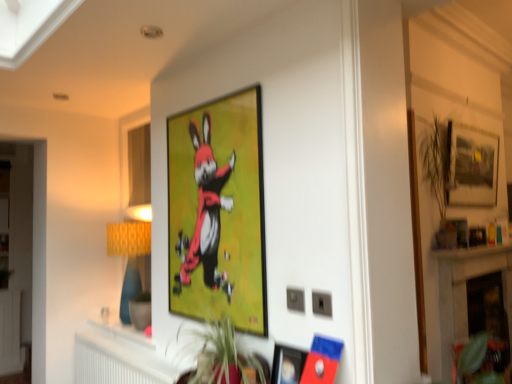
Locate an element on the screen. This screenshot has width=512, height=384. white plastic radiator at lower center is located at coordinates (117, 362).

Identify the location of matte plastic picture frame at lower center, the 1th picture frame when ordered from front to back. The image size is (512, 384). (287, 365).

The height and width of the screenshot is (384, 512). In order to click on green leafy plant at center, the second plant in the bottom-to-top sequence in this screenshot , I will do `click(223, 357)`.

At what (x,y) coordinates should I click in order to perform the action: click on matte black picture frame at upper center, which is the second picture frame from back to front. Please return your answer as a coordinate pair (x, y). Image resolution: width=512 pixels, height=384 pixels. Looking at the image, I should click on (218, 212).

Measure the distance between yellow fabric lampshade at left and camera.

They are 2.44 meters apart.

Where is `matte black picture frame at upper right, the first picture frame in the back-to-front sequence`? The height and width of the screenshot is (384, 512). matte black picture frame at upper right, the first picture frame in the back-to-front sequence is located at coordinates (472, 166).

Between yellow fabric lampshade at left and white marble fireplace at lower right, which one has more height?

white marble fireplace at lower right is taller.

Between yellow fabric lampshade at left and white marble fireplace at lower right, which one has larger size?

With larger size is white marble fireplace at lower right.

Which object is positioned more to the left, yellow fabric lampshade at left or white marble fireplace at lower right?

Positioned to the left is yellow fabric lampshade at left.

You are a GUI agent. You are given a task and a screenshot of the screen. Output one action in this format:
    pyautogui.click(x=<x>, y=<y>)
    Task: Click on the lamp in front of the white marble fireplace at lower right
    The image size is (512, 384).
    Given the screenshot: What is the action you would take?
    pyautogui.click(x=131, y=258)

Who is smaller, white plastic radiator at lower center or matte black picture frame at upper center, placed as the 2th picture frame when sorted from front to back?

Smaller between the two is matte black picture frame at upper center, placed as the 2th picture frame when sorted from front to back.

Considering the positions of objects white plastic radiator at lower center and matte black picture frame at upper center, which is the second picture frame from back to front, in the image provided, who is more to the left, white plastic radiator at lower center or matte black picture frame at upper center, which is the second picture frame from back to front,?

white plastic radiator at lower center.

Is white plastic radiator at lower center wider than matte black picture frame at upper center, placed as the 1th picture frame when sorted from left to right?

Yes.

Which is behind, point (479, 372) or point (120, 250)?

Point (120, 250)

Is green leafy plant at lower right, the 2th plant viewed from the top, located outside yellow fabric lampshade at left?

green leafy plant at lower right, the 2th plant viewed from the top, lies outside yellow fabric lampshade at left's area.

Can you tell me how much green leafy plant at lower right, the 2th plant viewed from the top, and yellow fabric lampshade at left differ in facing direction?

green leafy plant at lower right, the 2th plant viewed from the top, and yellow fabric lampshade at left are facing 90 degrees away from each other.

Is green leafy plant at lower right, arranged as the 1th plant when viewed from the right, facing away from yellow fabric lampshade at left?

That's not correct — green leafy plant at lower right, arranged as the 1th plant when viewed from the right, is not looking away from yellow fabric lampshade at left.

Based on the photo, between white marble fireplace at lower right and green leafy plant at center, the second plant in the bottom-to-top sequence, which one has smaller size?

green leafy plant at center, the second plant in the bottom-to-top sequence.

From a real-world perspective, which object rests below the other?

From a 3D spatial view, white marble fireplace at lower right is below.

From the image's perspective, which object appears higher, white marble fireplace at lower right or green leafy plant at center, placed as the first plant when sorted from left to right?

green leafy plant at center, placed as the first plant when sorted from left to right, is shown above in the image.

From the image's perspective, which one is positioned lower, matte plastic picture frame at lower center, the second picture frame from the right, or matte black picture frame at upper center, placed as the 1th picture frame when sorted from left to right?

matte plastic picture frame at lower center, the second picture frame from the right, is shown below in the image.

Is matte plastic picture frame at lower center, marked as the third picture frame in a back-to-front arrangement, not close to matte black picture frame at upper center, which is the second picture frame from back to front?

No.

Is matte plastic picture frame at lower center, which is counted as the second picture frame, starting from the left, positioned before matte black picture frame at upper center, placed as the 1th picture frame when sorted from left to right?

Yes, matte plastic picture frame at lower center, which is counted as the second picture frame, starting from the left, is closer to the camera.

Considering the relative sizes of white marble fireplace at lower right and yellow fabric lampshade at left in the image provided, is white marble fireplace at lower right bigger than yellow fabric lampshade at left?

Indeed, white marble fireplace at lower right has a larger size compared to yellow fabric lampshade at left.

In the scene shown: From a real-world perspective, relative to yellow fabric lampshade at left, is white marble fireplace at lower right vertically above or below?

white marble fireplace at lower right is situated lower than yellow fabric lampshade at left in the real world.

Is point (480, 270) less distant than point (110, 249)?

No, (480, 270) is behind (110, 249).

Which object is wider, white marble fireplace at lower right or yellow fabric lampshade at left?

yellow fabric lampshade at left.

Does green leafy plant at center, which is counted as the 1th plant, starting from the top, appear on the right side of matte black picture frame at upper right, acting as the third picture frame starting from the left?

No.

Considering the positions of point (232, 328) and point (486, 195), is point (232, 328) closer or farther from the camera than point (486, 195)?

Point (232, 328) appears to be closer to the viewer than point (486, 195).

Are green leafy plant at center, placed as the second plant when sorted from back to front, and matte black picture frame at upper right, the first picture frame in the back-to-front sequence, beside each other?

There is a gap between green leafy plant at center, placed as the second plant when sorted from back to front, and matte black picture frame at upper right, the first picture frame in the back-to-front sequence.

Does green leafy plant at center, which is counted as the 1th plant, starting from the top, have a lesser height compared to matte black picture frame at upper right, the first picture frame in the back-to-front sequence?

Yes, green leafy plant at center, which is counted as the 1th plant, starting from the top, is shorter than matte black picture frame at upper right, the first picture frame in the back-to-front sequence.

Image resolution: width=512 pixels, height=384 pixels. I want to click on fireplace lying on the right of yellow fabric lampshade at left, so click(x=466, y=291).

The height and width of the screenshot is (384, 512). What are the coordinates of `the 1st picture frame in front of the white plastic radiator at lower center, counting from the anchor's position` in the screenshot? It's located at 218,212.

Estimate the real-world distances between objects in this image. Which object is further from matte plastic picture frame at lower center, which is counted as the second picture frame, starting from the left, matte black picture frame at upper right, the 1th picture frame viewed from the right, or yellow fabric lampshade at left?

Based on the image, matte black picture frame at upper right, the 1th picture frame viewed from the right, appears to be further to matte plastic picture frame at lower center, which is counted as the second picture frame, starting from the left.

Looking at the image, which one is located further to white plastic radiator at lower center, matte plastic picture frame at lower center, marked as the third picture frame in a back-to-front arrangement, or yellow fabric lampshade at left?

matte plastic picture frame at lower center, marked as the third picture frame in a back-to-front arrangement.

Which object lies nearer to the anchor point white marble fireplace at lower right, green leafy plant at center, which is counted as the 1th plant, starting from the top, or matte black picture frame at upper right, the third picture frame viewed from the front?

matte black picture frame at upper right, the third picture frame viewed from the front, is positioned closer to the anchor white marble fireplace at lower right.

Looking at the image, which one is located further to green leafy plant at center, which appears as the second plant when viewed from the right, white plastic radiator at lower center or yellow fabric lampshade at left?

The object further to green leafy plant at center, which appears as the second plant when viewed from the right, is yellow fabric lampshade at left.

Based on their spatial positions, is yellow fabric lampshade at left or matte black picture frame at upper center, placed as the 1th picture frame when sorted from left to right, closer to matte black picture frame at upper right, the 1th picture frame viewed from the right?

matte black picture frame at upper center, placed as the 1th picture frame when sorted from left to right, lies closer to matte black picture frame at upper right, the 1th picture frame viewed from the right, than the other object.

Estimate the real-world distances between objects in this image. Which object is further from white marble fireplace at lower right, matte plastic picture frame at lower center, the 1th picture frame when ordered from front to back, or green leafy plant at center, which is counted as the 1th plant, starting from the top?

matte plastic picture frame at lower center, the 1th picture frame when ordered from front to back.

Considering their positions, is green leafy plant at lower right, the 2th plant viewed from the top, positioned closer to white marble fireplace at lower right than white plastic radiator at lower center?

green leafy plant at lower right, the 2th plant viewed from the top.

Based on their spatial positions, is matte black picture frame at upper center, placed as the 1th picture frame when sorted from left to right, or matte plastic picture frame at lower center, which is counted as the second picture frame, starting from the left, closer to white marble fireplace at lower right?

matte black picture frame at upper center, placed as the 1th picture frame when sorted from left to right, lies closer to white marble fireplace at lower right than the other object.

At what (x,y) coordinates should I click in order to perform the action: click on picture frame between matte black picture frame at upper center, placed as the 2th picture frame when sorted from front to back, and matte black picture frame at upper right, the 1th picture frame viewed from the right, in the horizontal direction. Please return your answer as a coordinate pair (x, y). The height and width of the screenshot is (384, 512). Looking at the image, I should click on (287, 365).

Where is `fireplace that lies between matte black picture frame at upper right, the 1th picture frame viewed from the right, and green leafy plant at lower right, the 2th plant viewed from the top, from top to bottom`? fireplace that lies between matte black picture frame at upper right, the 1th picture frame viewed from the right, and green leafy plant at lower right, the 2th plant viewed from the top, from top to bottom is located at coordinates (466, 291).

Find the location of a particular element. radiator between matte plastic picture frame at lower center, marked as the third picture frame in a back-to-front arrangement, and yellow fabric lampshade at left, along the z-axis is located at coordinates (117, 362).

Identify the location of plant situated between matte plastic picture frame at lower center, which is counted as the second picture frame, starting from the left, and white marble fireplace at lower right from left to right. (473, 355).